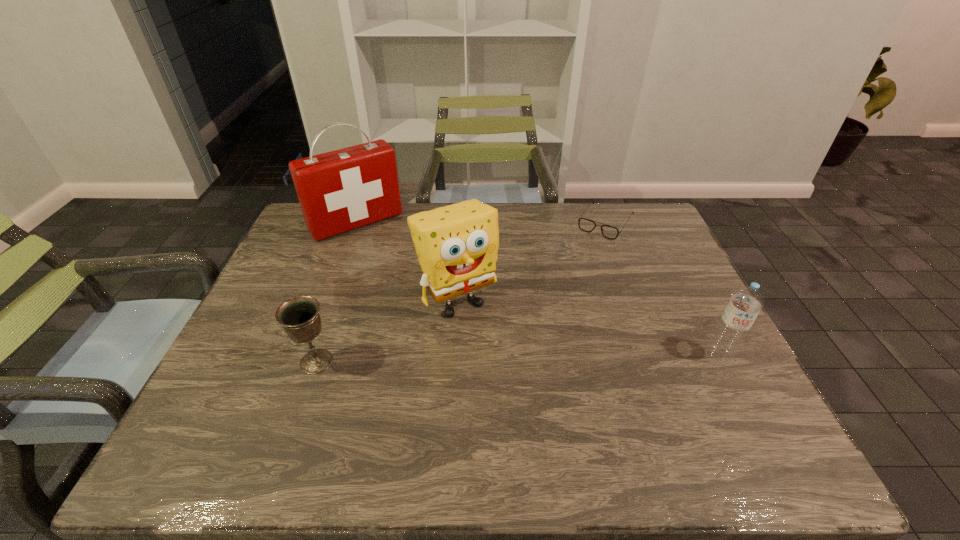
This screenshot has height=540, width=960. I want to click on the fourth tallest object, so [300, 318].

Where is `the third shortest object`? the third shortest object is located at coordinates (745, 304).

Identify the location of the rightmost object. (745, 304).

Identify the location of the third object from right to left. (457, 245).

Find the location of a particular element. The width and height of the screenshot is (960, 540). sponge is located at coordinates (457, 245).

Where is `the shortest object`? The width and height of the screenshot is (960, 540). the shortest object is located at coordinates (587, 225).

At what (x,y) coordinates should I click in order to perform the action: click on sunglasses. Please return your answer as a coordinate pair (x, y). The height and width of the screenshot is (540, 960). Looking at the image, I should click on (587, 225).

Find the location of a particular element. The height and width of the screenshot is (540, 960). the first-aid kit is located at coordinates (341, 190).

Identify the location of vacant space located 0.400m on the back of the second shortest object. (357, 246).

At what (x,y) coordinates should I click in order to perform the action: click on vacant space located 0.070m on the left of the water bottle. Please return your answer as a coordinate pair (x, y). Looking at the image, I should click on (675, 356).